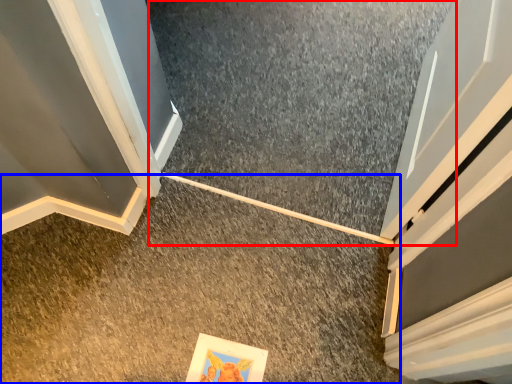
Question: Which point is closer to the camera, concrete (highlighted by a red box) or concrete (highlighted by a blue box)?

Choices:
 (A) concrete
 (B) concrete

Answer: (B)